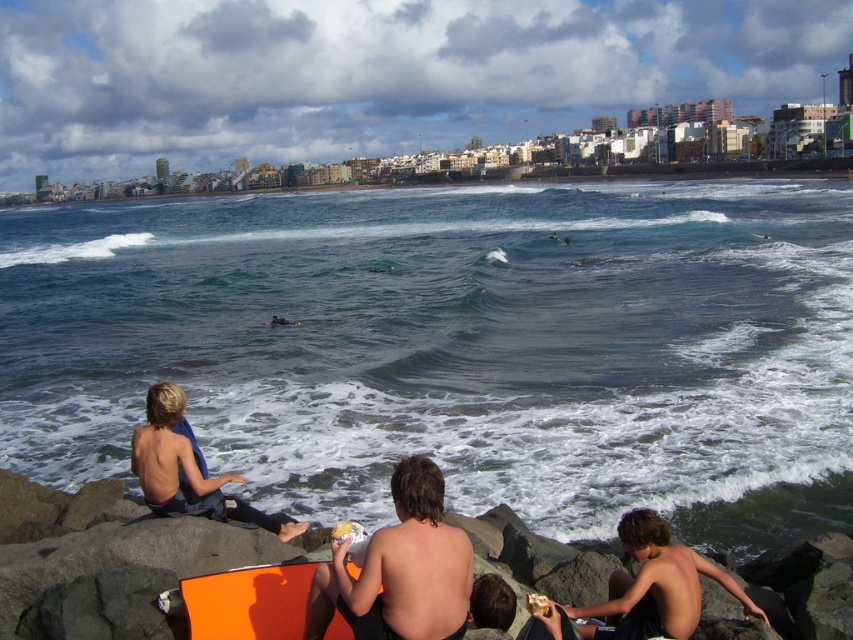
Question: Which of the following is the closest to the observer?

Choices:
 (A) (171, 486)
 (B) (471, 579)

Answer: (B)

Question: Is clear blue water at center below shiny orange surfboard at center?

Choices:
 (A) yes
 (B) no

Answer: (B)

Question: Is shiny orange surfboard at center wider than blue fabric surfer at lower left?

Choices:
 (A) yes
 (B) no

Answer: (B)

Question: Which object is closer to the camera taking this photo?

Choices:
 (A) clear blue water at center
 (B) blue fabric surfer at lower left
 (C) shiny orange surfboard at center

Answer: (C)

Question: Estimate the real-world distances between objects in this image. Which object is farther from the clear blue water at center?

Choices:
 (A) blue fabric surfer at lower left
 (B) shiny orange surfboard at center

Answer: (B)

Question: Can you confirm if shiny orange surfboard at center is thinner than blue fabric surfer at lower left?

Choices:
 (A) yes
 (B) no

Answer: (A)